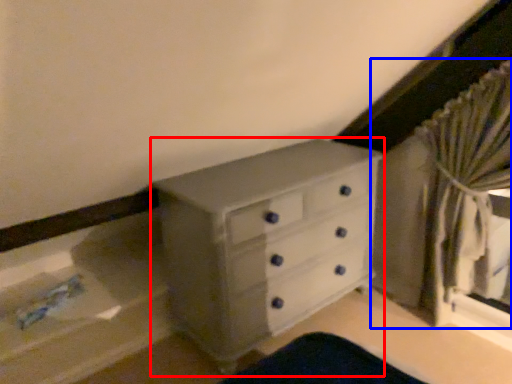
Question: Which object appears farthest to the camera in this image, chest of drawers (highlighted by a red box) or curtain (highlighted by a blue box)?

Choices:
 (A) chest of drawers
 (B) curtain

Answer: (A)